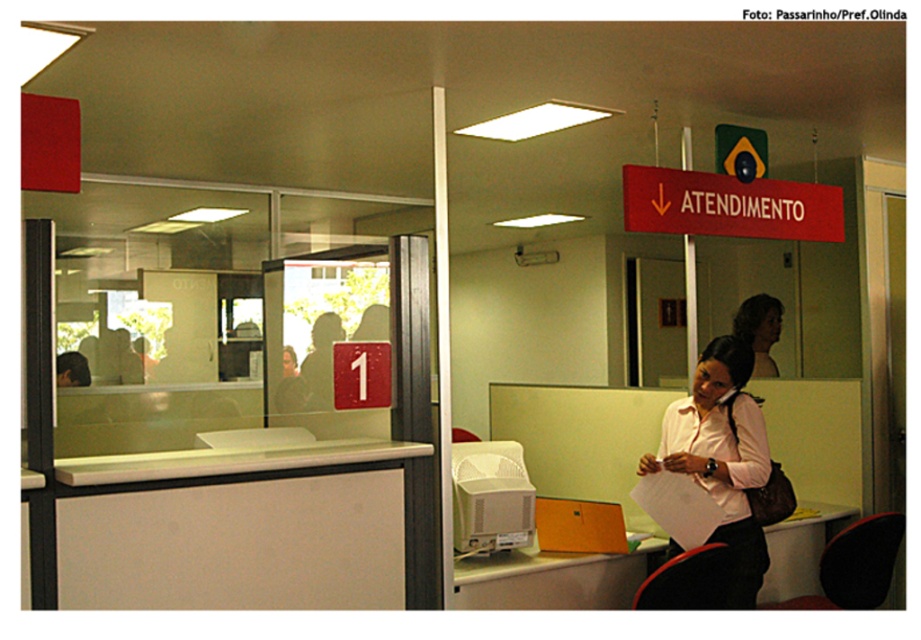
Question: Is white matte desk at center bigger than white matte shirt at center?

Choices:
 (A) yes
 (B) no

Answer: (A)

Question: Among these objects, which one is farthest from the camera?

Choices:
 (A) white matte desk at center
 (B) white matte shirt at center
 (C) white plastic printer at center
 (D) matte white blouse at center

Answer: (D)

Question: Which point is farther from the camera taking this photo?

Choices:
 (A) (754, 294)
 (B) (546, 588)
 (C) (257, 477)
 (D) (725, 426)

Answer: (A)

Question: Does white matte shirt at center come behind matte white blouse at center?

Choices:
 (A) no
 (B) yes

Answer: (A)

Question: Which point appears closest to the camera in this image?

Choices:
 (A) (146, 515)
 (B) (708, 372)
 (C) (484, 604)

Answer: (A)

Question: From the image, what is the correct spatial relationship of white plastic printer at center in relation to matte white blouse at center?

Choices:
 (A) left
 (B) right

Answer: (A)